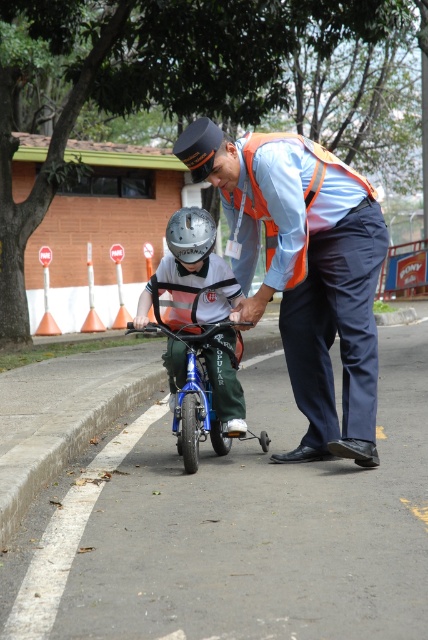
You are a delivery robot with a 32 inch wide package. You need to pass between the orange reflective vest at center and the blue metallic bicycle at center. Can you fit through the space between them?

The distance between the orange reflective vest at center and the blue metallic bicycle at center is 31.49 inches. Since the package is 32 inches wide, it is slightly wider than the available space. Therefore, the robot cannot fit through the space between them.

You are a pedestrian standing on the sidewalk. You see a point at coordinates (x=287, y=202). What object is located at that point?

The point at coordinates (x=287, y=202) corresponds to the orange reflective safety vest at center.